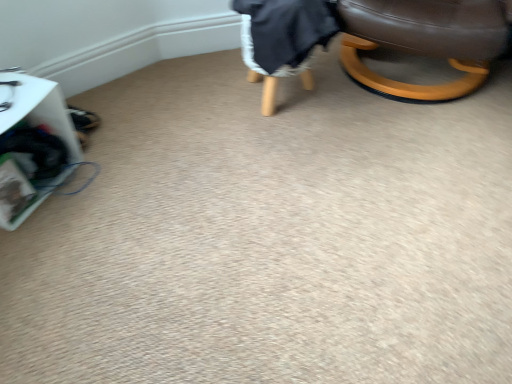
Measure the distance between white plastic basket at left and camera.

white plastic basket at left is 3.65 feet from camera.

Identify the location of white plastic basket at left. (37, 109).

Find the location of a particular element. The height and width of the screenshot is (384, 512). dark gray fabric bean bag chair at upper right is located at coordinates (283, 39).

Find the location of a particular element. white plastic basket at left is located at coordinates (37, 109).

Does brown leather chair at upper right come behind dark gray fabric bean bag chair at upper right?

No, brown leather chair at upper right is closer to the viewer.

Considering the relative sizes of brown leather chair at upper right and dark gray fabric bean bag chair at upper right in the image provided, is brown leather chair at upper right smaller than dark gray fabric bean bag chair at upper right?

Actually, brown leather chair at upper right might be larger than dark gray fabric bean bag chair at upper right.

From a real-world perspective, is brown leather chair at upper right above or below dark gray fabric bean bag chair at upper right?

From a real-world perspective, brown leather chair at upper right is physically above dark gray fabric bean bag chair at upper right.

I want to click on chair above the dark gray fabric bean bag chair at upper right (from a real-world perspective), so click(424, 41).

Is brown leather chair at upper right facing towards white plastic basket at left?

No, brown leather chair at upper right is not aimed at white plastic basket at left.

Does brown leather chair at upper right appear on the left side of white plastic basket at left?

No.

In terms of height, does brown leather chair at upper right look taller or shorter compared to white plastic basket at left?

brown leather chair at upper right is taller than white plastic basket at left.

Identify the location of chair on the right of white plastic basket at left. The width and height of the screenshot is (512, 384). (424, 41).

Would you consider white plastic basket at left to be distant from dark gray fabric bean bag chair at upper right?

Actually, white plastic basket at left and dark gray fabric bean bag chair at upper right are a little close together.

Consider the image. Is white plastic basket at left facing away from dark gray fabric bean bag chair at upper right?

That's not correct — white plastic basket at left is not looking away from dark gray fabric bean bag chair at upper right.

Does point (15, 179) appear closer or farther from the camera than point (327, 32)?

Clearly, point (15, 179) is closer to the camera than point (327, 32).

Which of these two, white plastic basket at left or brown leather chair at upper right, is wider?

brown leather chair at upper right.

Is white plastic basket at left oriented away from brown leather chair at upper right?

No, white plastic basket at left is not facing the opposite direction of brown leather chair at upper right.

From the image's perspective, is white plastic basket at left under brown leather chair at upper right?

Yes, from the image's perspective, white plastic basket at left is below brown leather chair at upper right.

Considering the relative sizes of white plastic basket at left and brown leather chair at upper right in the image provided, is white plastic basket at left bigger than brown leather chair at upper right?

No.

Is dark gray fabric bean bag chair at upper right looking in the opposite direction of brown leather chair at upper right?

No, dark gray fabric bean bag chair at upper right is not facing the opposite direction of brown leather chair at upper right.

Is dark gray fabric bean bag chair at upper right next to brown leather chair at upper right and touching it?

dark gray fabric bean bag chair at upper right and brown leather chair at upper right are not in contact.

Is dark gray fabric bean bag chair at upper right shorter than brown leather chair at upper right?

Indeed, dark gray fabric bean bag chair at upper right has a lesser height compared to brown leather chair at upper right.

Is dark gray fabric bean bag chair at upper right inside or outside of brown leather chair at upper right?

dark gray fabric bean bag chair at upper right lies outside brown leather chair at upper right.

Is dark gray fabric bean bag chair at upper right smaller than white plastic basket at left?

No, dark gray fabric bean bag chair at upper right is not smaller than white plastic basket at left.

In the scene shown: Is dark gray fabric bean bag chair at upper right positioned far away from white plastic basket at left?

That's not correct — dark gray fabric bean bag chair at upper right is a little close to white plastic basket at left.

In the scene shown: Does dark gray fabric bean bag chair at upper right turn towards white plastic basket at left?

No, dark gray fabric bean bag chair at upper right is not oriented towards white plastic basket at left.

The height and width of the screenshot is (384, 512). In order to click on bean bag chair below the brown leather chair at upper right (from the image's perspective) in this screenshot , I will do `click(283, 39)`.

The image size is (512, 384). Find the location of `chair above the white plastic basket at left (from the image's perspective)`. chair above the white plastic basket at left (from the image's perspective) is located at coordinates (424, 41).

Estimate the real-world distances between objects in this image. Which object is further from brown leather chair at upper right, white plastic basket at left or dark gray fabric bean bag chair at upper right?

white plastic basket at left is positioned further to the anchor brown leather chair at upper right.

When comparing their distances from white plastic basket at left, does dark gray fabric bean bag chair at upper right or brown leather chair at upper right seem closer?

dark gray fabric bean bag chair at upper right lies closer to white plastic basket at left than the other object.

Which object lies nearer to the anchor point white plastic basket at left, brown leather chair at upper right or dark gray fabric bean bag chair at upper right?

The object closer to white plastic basket at left is dark gray fabric bean bag chair at upper right.

In the scene shown: Considering their positions, is brown leather chair at upper right positioned further to dark gray fabric bean bag chair at upper right than white plastic basket at left?

Based on the image, white plastic basket at left appears to be further to dark gray fabric bean bag chair at upper right.

Considering their positions, is white plastic basket at left positioned closer to dark gray fabric bean bag chair at upper right than brown leather chair at upper right?

brown leather chair at upper right.

From the image, which object appears to be nearer to brown leather chair at upper right, dark gray fabric bean bag chair at upper right or white plastic basket at left?

Based on the image, dark gray fabric bean bag chair at upper right appears to be nearer to brown leather chair at upper right.

Where is `bean bag chair between white plastic basket at left and brown leather chair at upper right in the horizontal direction`? bean bag chair between white plastic basket at left and brown leather chair at upper right in the horizontal direction is located at coordinates (283, 39).